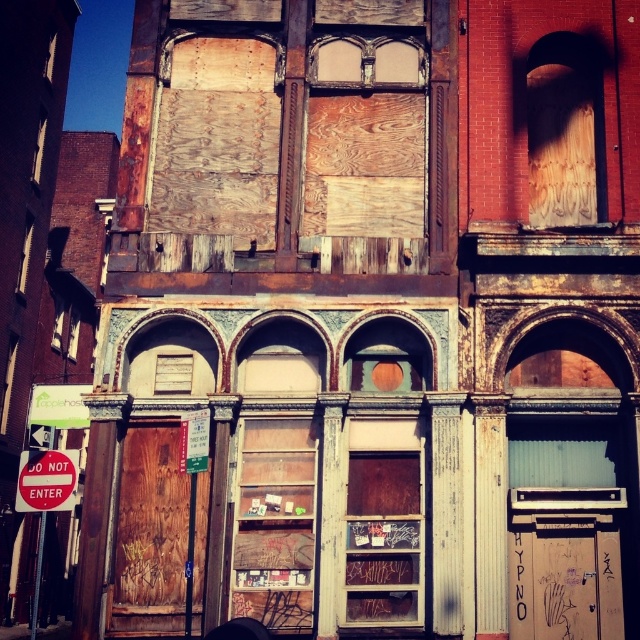
Question: Is red matte sign at lower left thinner than green plastic sign at center?

Choices:
 (A) yes
 (B) no

Answer: (B)

Question: Is red matte sign at lower left further to camera compared to green plastic sign at center?

Choices:
 (A) no
 (B) yes

Answer: (A)

Question: Can you confirm if red matte sign at lower left is positioned above green plastic sign at center?

Choices:
 (A) yes
 (B) no

Answer: (B)

Question: Which point is farther from the camera taking this photo?

Choices:
 (A) (189, 438)
 (B) (56, 467)

Answer: (B)